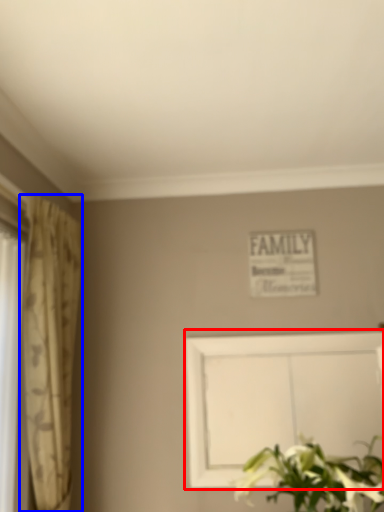
Question: Which point is further to the camera, picture frame (highlighted by a red box) or curtain (highlighted by a blue box)?

Choices:
 (A) picture frame
 (B) curtain

Answer: (A)